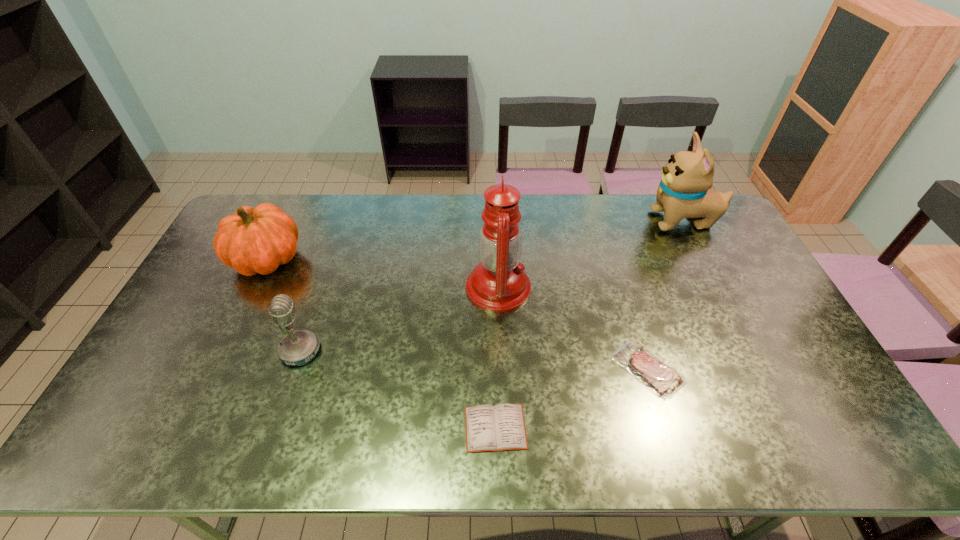
This screenshot has width=960, height=540. I want to click on object that is at the left edge, so click(255, 240).

Identify the location of object located in the right edge section of the desktop. The width and height of the screenshot is (960, 540). (684, 191).

This screenshot has height=540, width=960. In order to click on object that is at the far left corner in this screenshot , I will do `click(255, 240)`.

At what (x,y) coordinates should I click in order to perform the action: click on object present at the far right corner. Please return your answer as a coordinate pair (x, y). Looking at the image, I should click on [684, 191].

This screenshot has height=540, width=960. In the image, there is a desktop. In order to click on vacant space at the far edge in this screenshot , I will do `click(519, 226)`.

Where is `free space at the near edge of the desktop`? This screenshot has width=960, height=540. free space at the near edge of the desktop is located at coordinates [684, 452].

Where is `free space at the right edge`? Image resolution: width=960 pixels, height=540 pixels. free space at the right edge is located at coordinates click(720, 275).

Where is `unoccupied area between the tallest object and the steak`? The height and width of the screenshot is (540, 960). unoccupied area between the tallest object and the steak is located at coordinates (573, 328).

Find the location of a particular element. unoccupied position between the tallest object and the rightmost object is located at coordinates (590, 254).

Where is `free space between the tallest object and the fifth object from left to right`? free space between the tallest object and the fifth object from left to right is located at coordinates (573, 328).